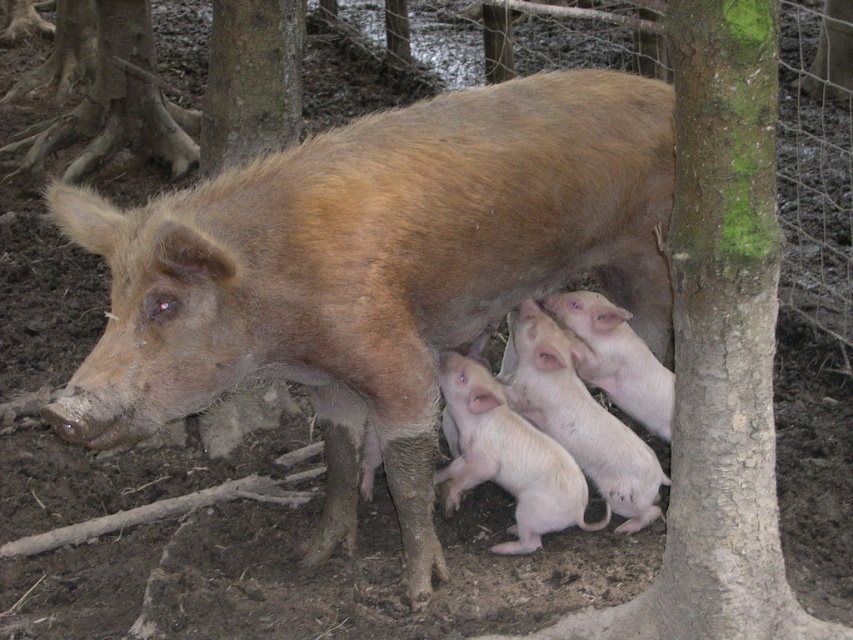
Question: Which point is farther from the camera taking this photo?

Choices:
 (A) (241, 108)
 (B) (534, 396)
 (C) (111, 24)

Answer: (C)

Question: From the image, what is the correct spatial relationship of brown rough tree trunk at center in relation to green rough bark at upper center?

Choices:
 (A) right
 (B) left

Answer: (B)

Question: Does brown matte piglet at lower center have a larger size compared to brown rough tree trunk at center?

Choices:
 (A) no
 (B) yes

Answer: (B)

Question: Which of these objects is positioned closest to the pink smooth piglets at center?

Choices:
 (A) brown rough tree trunk at center
 (B) green rough bark at upper center

Answer: (B)

Question: Is smooth pink piglets at center positioned in front of green rough bark at upper center?

Choices:
 (A) yes
 (B) no

Answer: (A)

Question: Which object is the farthest from the pink smooth piglets at center?

Choices:
 (A) smooth pink piglets at center
 (B) green rough bark at upper center
 (C) brown matte piglet at lower center
 (D) brown rough tree trunk at center

Answer: (D)